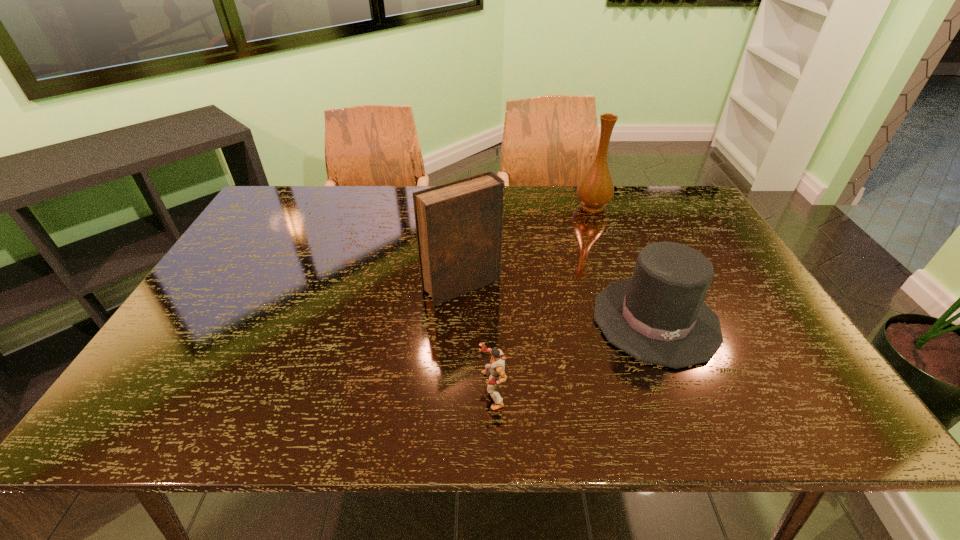
Identify the location of vase. (595, 190).

This screenshot has width=960, height=540. In order to click on Bible in this screenshot , I will do `click(459, 225)`.

Identify the location of dress hat. The image size is (960, 540). [658, 316].

Locate an element on the screen. the nearest object is located at coordinates (495, 370).

The width and height of the screenshot is (960, 540). Identify the location of the shortest object. (495, 370).

Find the location of a particular element. This screenshot has width=960, height=540. vacant space located on the right of the farthest object is located at coordinates (658, 206).

Identify the location of vacant space situated 0.340m on the right of the Bible. (628, 286).

Where is `blank space located on the front of the dress hat with the decoration`? The image size is (960, 540). blank space located on the front of the dress hat with the decoration is located at coordinates (689, 402).

You are a GUI agent. You are given a task and a screenshot of the screen. Output one action in this format:
    pyautogui.click(x=<x>, y=<y>)
    Task: Click on the vacant position located on the front-facing side of the puncher
    Image resolution: width=960 pixels, height=540 pixels.
    Given the screenshot: What is the action you would take?
    pyautogui.click(x=291, y=390)

In order to click on vacant space located on the front-facing side of the puncher in this screenshot , I will do coord(418,390).